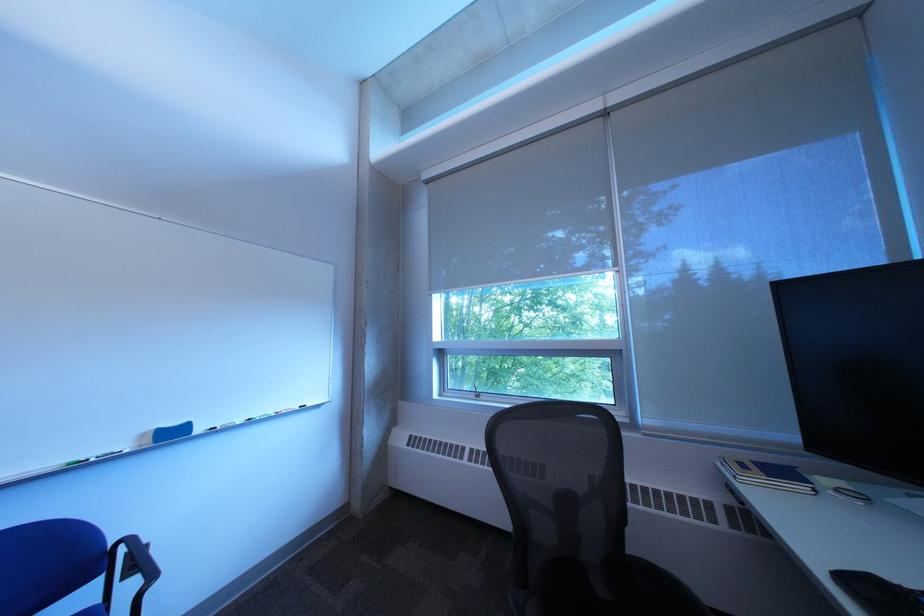
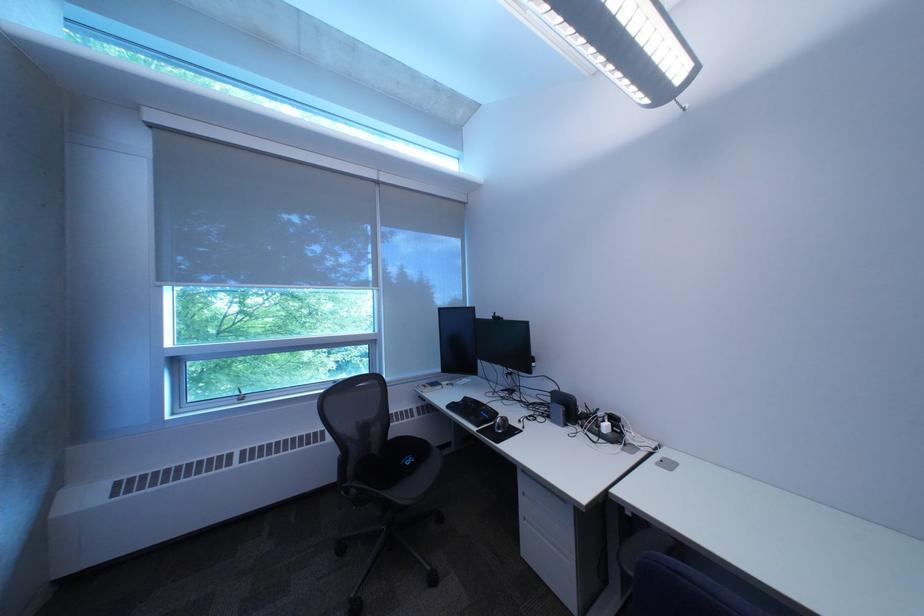
Find the pixel in the second image that matches the point at 860,582 in the first image.

(464, 408)